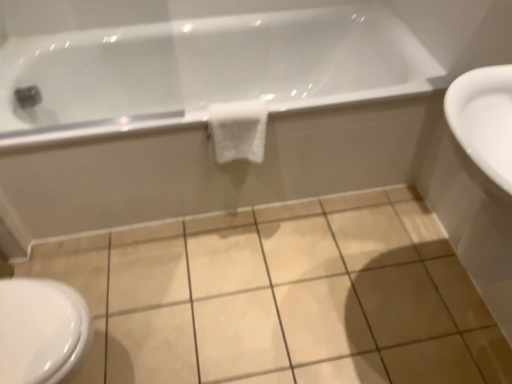
The image size is (512, 384). In order to click on free spot below white glossy sink at right (from a real-world perspective) in this screenshot , I will do `click(425, 309)`.